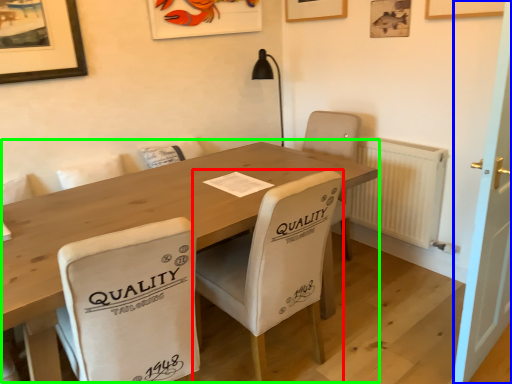
Question: Estimate the real-world distances between objects in this image. Which object is farther from chair (highlighted by a red box), door (highlighted by a blue box) or table (highlighted by a green box)?

Choices:
 (A) door
 (B) table

Answer: (A)